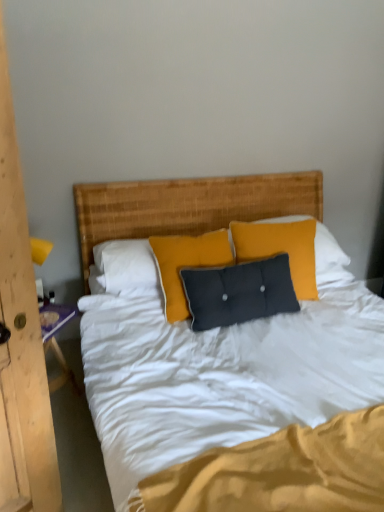
Question: Can you confirm if velvet dark gray pillow at center is thinner than wooden nightstand at left?

Choices:
 (A) yes
 (B) no

Answer: (A)

Question: Is velvet dark gray pillow at center not within wooden nightstand at left?

Choices:
 (A) no
 (B) yes

Answer: (B)

Question: Is the position of velvet dark gray pillow at center more distant than that of wooden nightstand at left?

Choices:
 (A) no
 (B) yes

Answer: (B)

Question: Is velvet dark gray pillow at center taller than wooden nightstand at left?

Choices:
 (A) no
 (B) yes

Answer: (B)

Question: Is velvet dark gray pillow at center smaller than wooden nightstand at left?

Choices:
 (A) yes
 (B) no

Answer: (B)

Question: Does velvet dark gray pillow at center lie in front of wooden nightstand at left?

Choices:
 (A) no
 (B) yes

Answer: (A)

Question: From a real-world perspective, is wooden nightstand at left located beneath velvet dark gray pillow at center?

Choices:
 (A) no
 (B) yes

Answer: (B)

Question: From the image's perspective, is wooden nightstand at left above velvet dark gray pillow at center?

Choices:
 (A) no
 (B) yes

Answer: (A)

Question: Would you say wooden nightstand at left is a long distance from velvet dark gray pillow at center?

Choices:
 (A) yes
 (B) no

Answer: (A)

Question: Considering the relative positions of wooden nightstand at left and velvet dark gray pillow at center in the image provided, is wooden nightstand at left to the left of velvet dark gray pillow at center from the viewer's perspective?

Choices:
 (A) no
 (B) yes

Answer: (B)

Question: Could you tell me if wooden nightstand at left is facing velvet dark gray pillow at center?

Choices:
 (A) yes
 (B) no

Answer: (B)

Question: Does wooden nightstand at left have a greater height compared to velvet dark gray pillow at center?

Choices:
 (A) no
 (B) yes

Answer: (A)

Question: Is wooden nightstand at left spatially inside velvet dark gray pillow at center, or outside of it?

Choices:
 (A) outside
 (B) inside

Answer: (A)